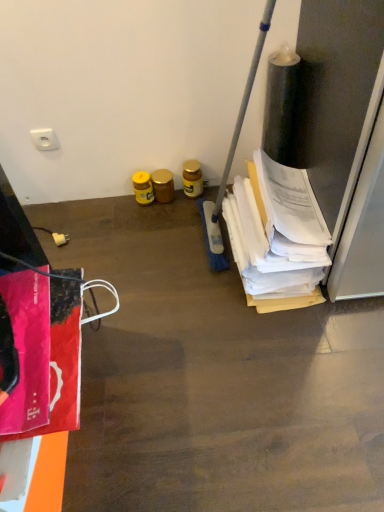
What do you see at coordinates (44, 139) in the screenshot? I see `white plastic socket at upper left, placed as the 2th power plugs and sockets when sorted from bottom to top` at bounding box center [44, 139].

This screenshot has height=512, width=384. In order to click on white paper at right in this screenshot , I will do `click(277, 237)`.

You are a GUI agent. You are given a task and a screenshot of the screen. Output one action in this format:
    pyautogui.click(x=<x>, y=<y>)
    Task: Click on the yellow matte jar at center, the first bottle viewed from the right
    
    Given the screenshot: What is the action you would take?
    coord(192,178)

From the image's perspective, count 2nd bottles downward from the white plastic socket at upper left, which is the 1th power plugs and sockets from top to bottom, and point to it. Please provide its 2D coordinates.

[(163, 185)]

Can white plastic socket at upper left, which is the 1th power plugs and sockets from top to bottom, be found inside gold metallic jar at center, positioned as the 2th bottle in left-to-right order?

Actually, white plastic socket at upper left, which is the 1th power plugs and sockets from top to bottom, is outside gold metallic jar at center, positioned as the 2th bottle in left-to-right order.

Is gold metallic jar at center, positioned as the 2th bottle in left-to-right order, thinner than white plastic socket at upper left, which is the 1th power plugs and sockets from top to bottom?

In fact, gold metallic jar at center, positioned as the 2th bottle in left-to-right order, might be wider than white plastic socket at upper left, which is the 1th power plugs and sockets from top to bottom.

Based on the photo, could you tell me if white plastic plug at lower left, the first power plugs and sockets in the bottom-to-top sequence, is turned towards yellow matte jar at center, the 3th bottle viewed from the left?

No.

From the image's perspective, is white plastic plug at lower left, the first power plugs and sockets in the bottom-to-top sequence, located above or below yellow matte jar at center, the first bottle viewed from the right?

white plastic plug at lower left, the first power plugs and sockets in the bottom-to-top sequence, is situated lower than yellow matte jar at center, the first bottle viewed from the right, in the image.

Who is smaller, white plastic plug at lower left, the first power plugs and sockets in the bottom-to-top sequence, or yellow matte jar at center, the 3th bottle viewed from the left?

Smaller between the two is white plastic plug at lower left, the first power plugs and sockets in the bottom-to-top sequence.

From a real-world perspective, which is physically below, white plastic plug at lower left, the first power plugs and sockets in the bottom-to-top sequence, or yellow matte jar at center, the 3th bottle viewed from the left?

white plastic plug at lower left, the first power plugs and sockets in the bottom-to-top sequence.

Is white plastic plug at lower left, the first power plugs and sockets in the bottom-to-top sequence, a part of yellow glossy jar at center, which ranks as the first bottle in left-to-right order?

No, white plastic plug at lower left, the first power plugs and sockets in the bottom-to-top sequence, is not surrounded by yellow glossy jar at center, which ranks as the first bottle in left-to-right order.

Considering the relative positions of yellow glossy jar at center, which ranks as the first bottle in left-to-right order, and white plastic plug at lower left, the first power plugs and sockets in the bottom-to-top sequence, in the image provided, is yellow glossy jar at center, which ranks as the first bottle in left-to-right order, behind white plastic plug at lower left, the first power plugs and sockets in the bottom-to-top sequence,?

Yes, it is.

Considering the sizes of yellow glossy jar at center, which ranks as the first bottle in left-to-right order, and white plastic plug at lower left, the second power plugs and sockets positioned from the top, in the image, is yellow glossy jar at center, which ranks as the first bottle in left-to-right order, taller or shorter than white plastic plug at lower left, the second power plugs and sockets positioned from the top,?

In the image, yellow glossy jar at center, which ranks as the first bottle in left-to-right order, appears to be taller than white plastic plug at lower left, the second power plugs and sockets positioned from the top.

Based on the photo, from the image's perspective, does yellow glossy jar at center, which ranks as the first bottle in left-to-right order, appear higher than white plastic plug at lower left, the first power plugs and sockets in the bottom-to-top sequence?

Yes, from the image's perspective, yellow glossy jar at center, which ranks as the first bottle in left-to-right order, is above white plastic plug at lower left, the first power plugs and sockets in the bottom-to-top sequence.

From the image's perspective, which one is positioned higher, white plastic plug at lower left, the second power plugs and sockets positioned from the top, or yellow glossy jar at center, the third bottle viewed from the right?

yellow glossy jar at center, the third bottle viewed from the right, is shown above in the image.

How many degrees apart are the facing directions of white plastic plug at lower left, the second power plugs and sockets positioned from the top, and yellow glossy jar at center, which ranks as the first bottle in left-to-right order?

They differ by 92.9 degrees in their facing directions.

Is white plastic plug at lower left, the second power plugs and sockets positioned from the top, facing away from yellow glossy jar at center, the third bottle viewed from the right?

No, yellow glossy jar at center, the third bottle viewed from the right, is not at the back of white plastic plug at lower left, the second power plugs and sockets positioned from the top.

Between white plastic plug at lower left, the second power plugs and sockets positioned from the top, and yellow glossy jar at center, the third bottle viewed from the right, which one has larger width?

With larger width is yellow glossy jar at center, the third bottle viewed from the right.

Does gold metallic jar at center, which is counted as the 2th bottle, starting from the right, have a lesser width compared to white paper at right?

Yes, gold metallic jar at center, which is counted as the 2th bottle, starting from the right, is thinner than white paper at right.

I want to click on wrapping paper to the right of gold metallic jar at center, positioned as the 2th bottle in left-to-right order, so click(277, 237).

Based on their positions, is gold metallic jar at center, which is counted as the 2th bottle, starting from the right, located to the left or right of white paper at right?

gold metallic jar at center, which is counted as the 2th bottle, starting from the right, is positioned on white paper at right's left side.

From a real-world perspective, which is physically below, white plastic plug at lower left, the first power plugs and sockets in the bottom-to-top sequence, or white paper at right?

white plastic plug at lower left, the first power plugs and sockets in the bottom-to-top sequence, from a real-world perspective.

How different are the orientations of white plastic plug at lower left, the second power plugs and sockets positioned from the top, and white paper at right in degrees?

white plastic plug at lower left, the second power plugs and sockets positioned from the top, and white paper at right are facing 2.9 degrees away from each other.

Considering the positions of objects white plastic plug at lower left, the first power plugs and sockets in the bottom-to-top sequence, and white paper at right in the image provided, who is more to the left, white plastic plug at lower left, the first power plugs and sockets in the bottom-to-top sequence, or white paper at right?

Positioned to the left is white plastic plug at lower left, the first power plugs and sockets in the bottom-to-top sequence.

In the scene shown: Looking at the image, does white paper at right seem bigger or smaller compared to yellow matte jar at center, the first bottle viewed from the right?

Considering their sizes, white paper at right takes up more space than yellow matte jar at center, the first bottle viewed from the right.

Is white paper at right taller than yellow matte jar at center, the first bottle viewed from the right?

Correct, white paper at right is much taller as yellow matte jar at center, the first bottle viewed from the right.

Which object is closer to the camera, white paper at right or yellow matte jar at center, the first bottle viewed from the right?

white paper at right is closer to the camera.

At what (x,y) coordinates should I click in order to perform the action: click on the 3rd bottle located beneath the white plastic socket at upper left, placed as the 2th power plugs and sockets when sorted from bottom to top (from a real-world perspective). Please return your answer as a coordinate pair (x, y). The image size is (384, 512). Looking at the image, I should click on (163, 185).

Image resolution: width=384 pixels, height=512 pixels. Identify the location of power plugs and sockets that is the 1st one when counting leftward from the yellow matte jar at center, the first bottle viewed from the right. (60, 239).

From the image, which object appears to be nearer to white paper at right, gold metallic jar at center, which is counted as the 2th bottle, starting from the right, or white plastic plug at lower left, the first power plugs and sockets in the bottom-to-top sequence?

The object closer to white paper at right is gold metallic jar at center, which is counted as the 2th bottle, starting from the right.

Which object lies further to the anchor point gold metallic jar at center, which is counted as the 2th bottle, starting from the right, white plastic socket at upper left, which is the 1th power plugs and sockets from top to bottom, or yellow glossy jar at center, the third bottle viewed from the right?

white plastic socket at upper left, which is the 1th power plugs and sockets from top to bottom, is positioned further to the anchor gold metallic jar at center, which is counted as the 2th bottle, starting from the right.

Considering their positions, is yellow glossy jar at center, which ranks as the first bottle in left-to-right order, positioned closer to white plastic plug at lower left, the first power plugs and sockets in the bottom-to-top sequence, than gold metallic jar at center, positioned as the 2th bottle in left-to-right order?

yellow glossy jar at center, which ranks as the first bottle in left-to-right order, lies closer to white plastic plug at lower left, the first power plugs and sockets in the bottom-to-top sequence, than the other object.

Looking at the image, which one is located closer to white plastic plug at lower left, the first power plugs and sockets in the bottom-to-top sequence, white paper at right or yellow glossy jar at center, the third bottle viewed from the right?

The object closer to white plastic plug at lower left, the first power plugs and sockets in the bottom-to-top sequence, is yellow glossy jar at center, the third bottle viewed from the right.

From the image, which object appears to be farther from yellow matte jar at center, the 3th bottle viewed from the left, gold metallic jar at center, which is counted as the 2th bottle, starting from the right, or white plastic socket at upper left, which is the 1th power plugs and sockets from top to bottom?

white plastic socket at upper left, which is the 1th power plugs and sockets from top to bottom, lies further to yellow matte jar at center, the 3th bottle viewed from the left, than the other object.

Based on their spatial positions, is yellow glossy jar at center, the third bottle viewed from the right, or yellow matte jar at center, the first bottle viewed from the right, further from white paper at right?

The object further to white paper at right is yellow glossy jar at center, the third bottle viewed from the right.

Looking at the image, which one is located closer to white plastic socket at upper left, placed as the 2th power plugs and sockets when sorted from bottom to top, gold metallic jar at center, which is counted as the 2th bottle, starting from the right, or yellow glossy jar at center, which ranks as the first bottle in left-to-right order?

The object closer to white plastic socket at upper left, placed as the 2th power plugs and sockets when sorted from bottom to top, is yellow glossy jar at center, which ranks as the first bottle in left-to-right order.

Looking at the image, which one is located further to yellow glossy jar at center, the third bottle viewed from the right, gold metallic jar at center, positioned as the 2th bottle in left-to-right order, or white plastic plug at lower left, the second power plugs and sockets positioned from the top?

Based on the image, white plastic plug at lower left, the second power plugs and sockets positioned from the top, appears to be further to yellow glossy jar at center, the third bottle viewed from the right.

I want to click on power plugs and sockets between white plastic socket at upper left, placed as the 2th power plugs and sockets when sorted from bottom to top, and yellow glossy jar at center, which ranks as the first bottle in left-to-right order, so click(x=60, y=239).

The image size is (384, 512). I want to click on bottle between yellow glossy jar at center, the third bottle viewed from the right, and yellow matte jar at center, the 3th bottle viewed from the left, in the horizontal direction, so click(x=163, y=185).

Find the location of `bottle between white plastic socket at upper left, placed as the 2th power plugs and sockets when sorted from bottom to top, and gold metallic jar at center, positioned as the 2th bottle in left-to-right order`. bottle between white plastic socket at upper left, placed as the 2th power plugs and sockets when sorted from bottom to top, and gold metallic jar at center, positioned as the 2th bottle in left-to-right order is located at coordinates (143, 187).

The image size is (384, 512). What are the coordinates of `bottle between white paper at right and yellow glossy jar at center, the third bottle viewed from the right, from front to back` in the screenshot? It's located at (192, 178).